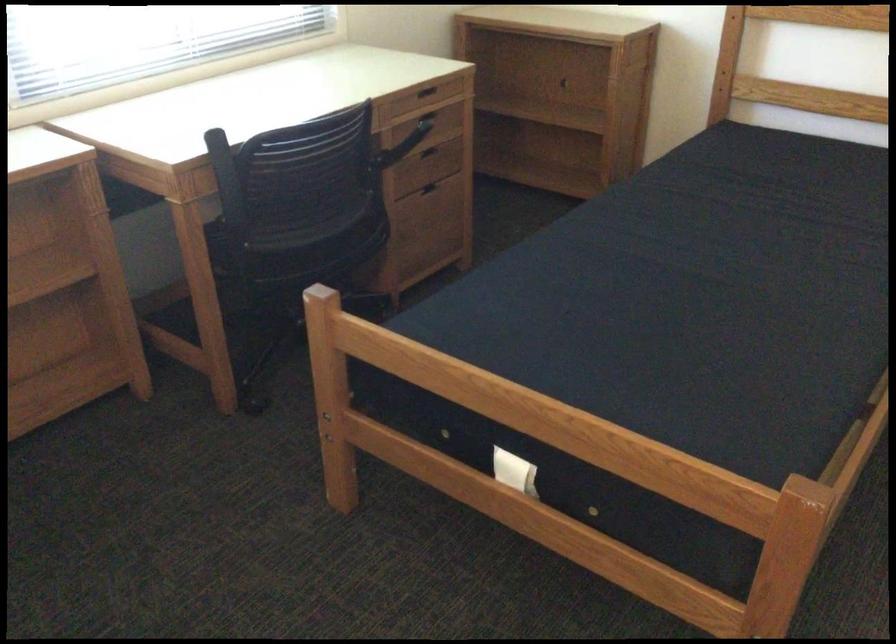
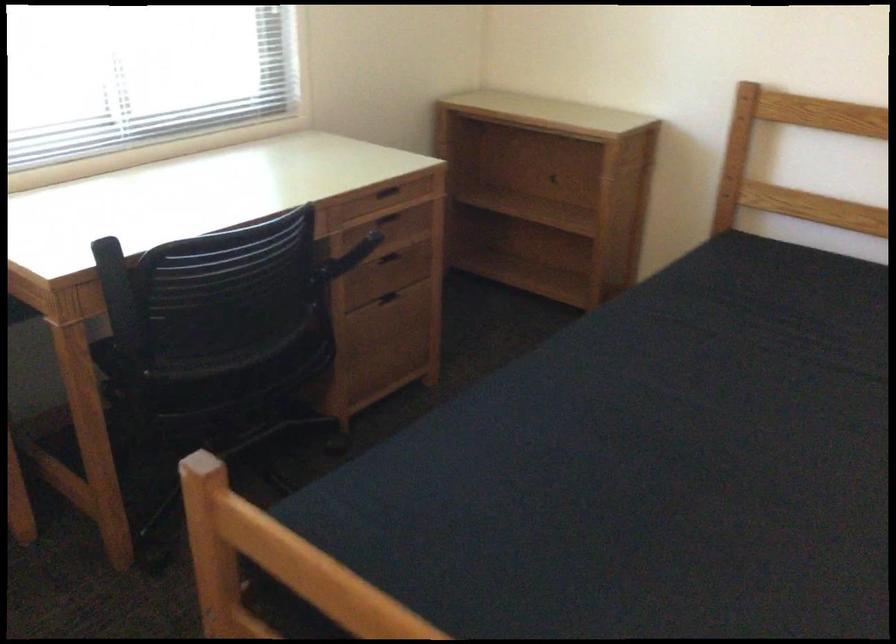
Question: In a continuous first-person perspective shot, in which direction is the camera moving?

Choices:
 (A) Left
 (B) Right
 (C) Forward
 (D) Backward

Answer: (C)